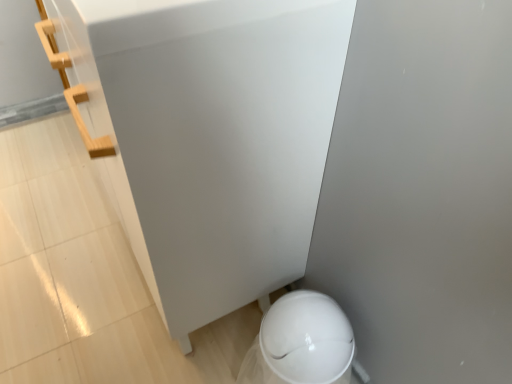
Locate an element on the screen. Image resolution: width=512 pixels, height=384 pixels. white glossy toilet at lower right is located at coordinates (x=301, y=342).

Describe the element at coordinates (301, 342) in the screenshot. I see `white glossy toilet at lower right` at that location.

Find the location of `white glossy toilet at lower right`. white glossy toilet at lower right is located at coordinates (301, 342).